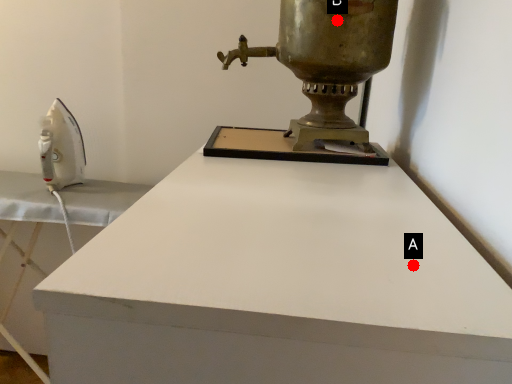
Question: Two points are circled on the image, labeled by A and B beside each circle. Which of the following is the closest to the observer?

Choices:
 (A) A is closer
 (B) B is closer

Answer: (A)